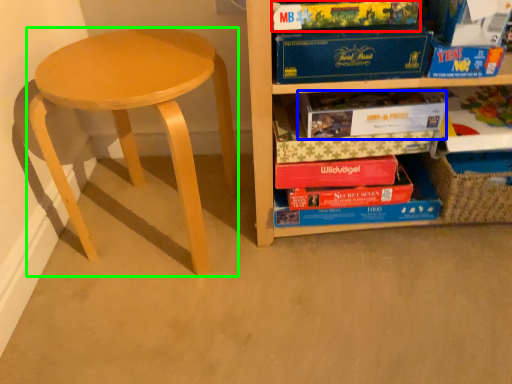
Question: Which object is positioned closest to paperback book (highlighted by a red box)? Select from paperback book (highlighted by a blue box) and stool (highlighted by a green box).

Choices:
 (A) paperback book
 (B) stool

Answer: (A)